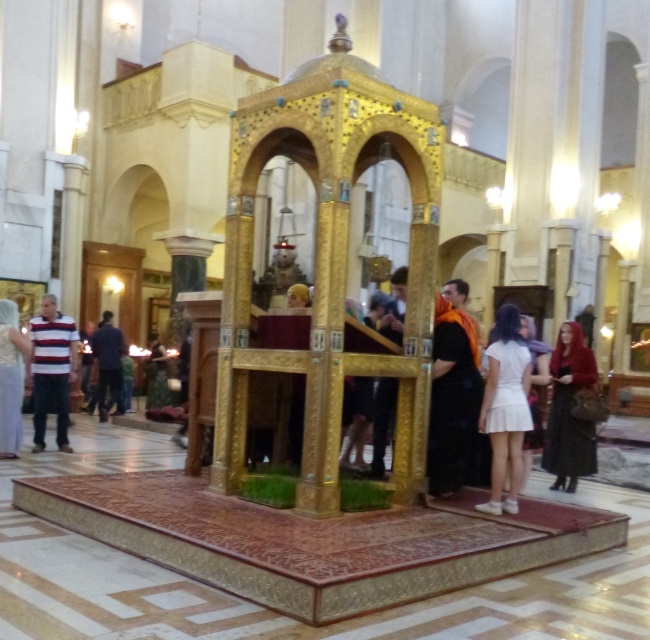
You are a visitor in the cathedral and see a white matte skirt at center and a striped fabric shirt at left. Which item is located to the right of the other?

The white matte skirt at center is positioned on the right side of striped fabric shirt at left.

You are a visitor at the church and see a velvet red coat at right and a dark brown leather jacket at center. Which one is smaller in size?

The velvet red coat at right is smaller than the dark brown leather jacket at center.